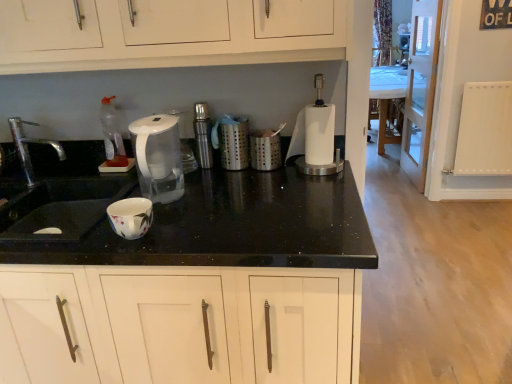
Question: In the image, is black granite countertop at center positioned in front of or behind white glossy table at center?

Choices:
 (A) behind
 (B) front

Answer: (B)

Question: From the image's perspective, is black granite countertop at center located above or below white glossy table at center?

Choices:
 (A) above
 (B) below

Answer: (B)

Question: Estimate the real-world distances between objects in this image. Which object is farther from the satin nickel faucet at center?

Choices:
 (A) transparent plastic kettle at center
 (B) white glossy table at center
 (C) satin silver strainer at center
 (D) silver metallic faucet at left
 (E) white plastic blender at center

Answer: (B)

Question: Which object is positioned farthest from the satin nickel faucet at center?

Choices:
 (A) white plastic blender at center
 (B) white glossy table at center
 (C) transparent plastic kettle at center
 (D) silver metallic faucet at left
 (E) satin silver strainer at center

Answer: (B)